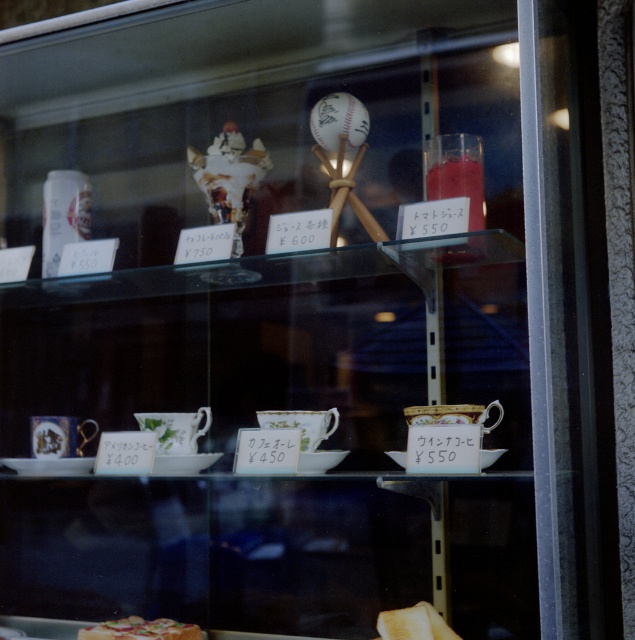
Which is in front, point (170, 637) or point (396, 627)?

Point (396, 627)

Is point (102, 634) closer to camera compared to point (429, 612)?

No, it is behind (429, 612).

Describe the element at coordinates (140, 628) in the screenshot. This screenshot has height=640, width=635. I see `shiny plastic pizza at lower center` at that location.

This screenshot has width=635, height=640. Find the location of `shiny plastic pizza at lower center`. shiny plastic pizza at lower center is located at coordinates (140, 628).

Can you confirm if golden toasted bread at lower center is taller than white porcelain saucer at lower center?

Yes.

Is golden toasted bread at lower center bigger than white porcelain saucer at lower center?

No, golden toasted bread at lower center is not bigger than white porcelain saucer at lower center.

Does point (429, 604) come farther from viewer compared to point (483, 464)?

Yes, it is.

Where is `golden toasted bread at lower center`? golden toasted bread at lower center is located at coordinates (413, 624).

Which of these two, shiny plastic pizza at lower center or white porcelain saucer at lower center, stands shorter?

Standing shorter between the two is shiny plastic pizza at lower center.

Between point (180, 634) and point (488, 465), which one is positioned behind?

Positioned behind is point (180, 634).

Is point (102, 636) positioned before point (486, 464)?

That is False.

Locate an element on the screen. The height and width of the screenshot is (640, 635). shiny plastic pizza at lower center is located at coordinates (140, 628).